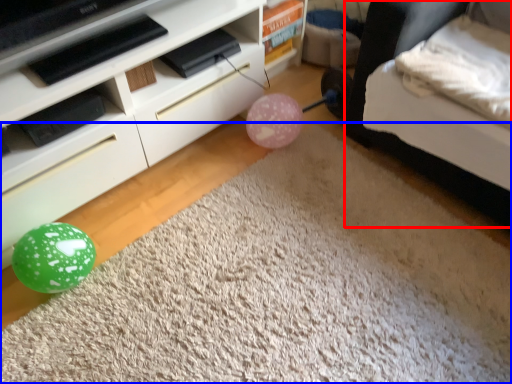
Question: Which of the following is the farthest to the observer, bed (highlighted by a red box) or plain (highlighted by a blue box)?

Choices:
 (A) bed
 (B) plain

Answer: (A)